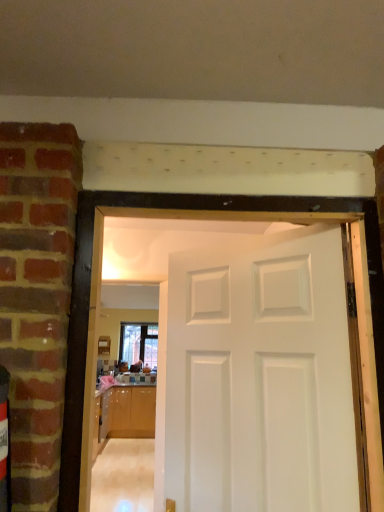
Question: From a real-world perspective, is white painted wood door at center physically below clear glass window at center?

Choices:
 (A) yes
 (B) no

Answer: (A)

Question: Would you say white painted wood door at center is a long distance from clear glass window at center?

Choices:
 (A) no
 (B) yes

Answer: (B)

Question: From the image's perspective, is white painted wood door at center on top of clear glass window at center?

Choices:
 (A) yes
 (B) no

Answer: (A)

Question: From a real-world perspective, does white painted wood door at center stand above clear glass window at center?

Choices:
 (A) no
 (B) yes

Answer: (A)

Question: Considering the relative positions of white painted wood door at center and clear glass window at center in the image provided, is white painted wood door at center to the left of clear glass window at center from the viewer's perspective?

Choices:
 (A) yes
 (B) no

Answer: (B)

Question: Does white painted wood door at center have a larger size compared to clear glass window at center?

Choices:
 (A) yes
 (B) no

Answer: (A)

Question: Is glossy wood cabinetry at lower left facing towards white painted wood door at center?

Choices:
 (A) yes
 (B) no

Answer: (A)

Question: Does glossy wood cabinetry at lower left have a smaller size compared to white painted wood door at center?

Choices:
 (A) yes
 (B) no

Answer: (B)

Question: Can you confirm if glossy wood cabinetry at lower left is positioned to the left of white painted wood door at center?

Choices:
 (A) yes
 (B) no

Answer: (A)

Question: Is glossy wood cabinetry at lower left located outside white painted wood door at center?

Choices:
 (A) yes
 (B) no

Answer: (A)

Question: Is glossy wood cabinetry at lower left closer to camera compared to white painted wood door at center?

Choices:
 (A) no
 (B) yes

Answer: (A)

Question: Is glossy wood cabinetry at lower left facing away from white painted wood door at center?

Choices:
 (A) no
 (B) yes

Answer: (A)

Question: Can you confirm if glossy wood cabinetry at lower left is positioned to the left of clear glass window at center?

Choices:
 (A) yes
 (B) no

Answer: (B)